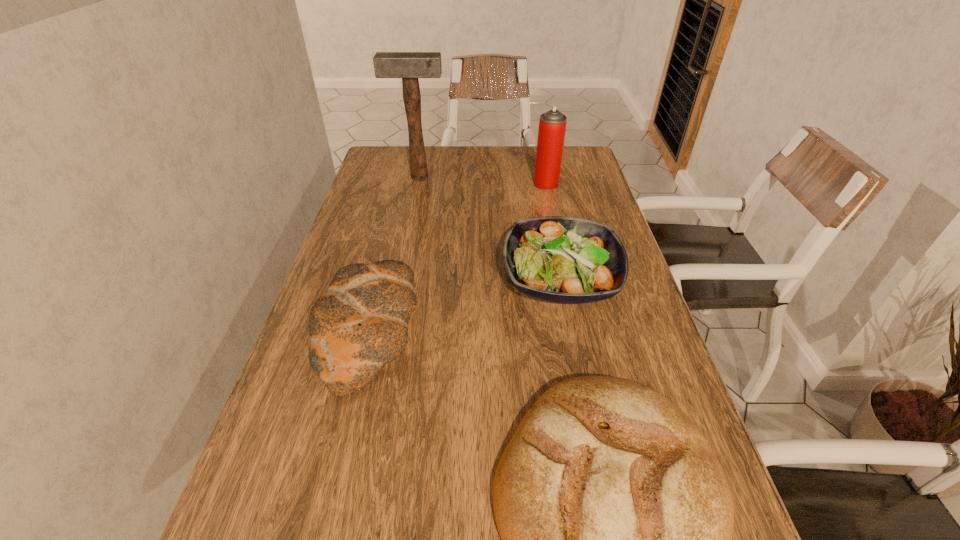
The height and width of the screenshot is (540, 960). I want to click on mallet, so click(409, 66).

At what (x,y) coordinates should I click in order to perform the action: click on aerosol can. Please return your answer as a coordinate pair (x, y). The width and height of the screenshot is (960, 540). Looking at the image, I should click on (552, 125).

This screenshot has height=540, width=960. In order to click on the left bread in this screenshot , I will do `click(359, 325)`.

Where is `salad plate`? This screenshot has height=540, width=960. salad plate is located at coordinates (557, 259).

Identify the location of vacant region located 0.150m on the front of the mallet. (414, 206).

Image resolution: width=960 pixels, height=540 pixels. What are the coordinates of `vacant space positioned on the left of the aerosol can` in the screenshot? It's located at pos(436,184).

Where is `vacant region located on the right of the left bread`? The width and height of the screenshot is (960, 540). vacant region located on the right of the left bread is located at coordinates (553, 330).

The height and width of the screenshot is (540, 960). Find the location of `vacant area situated on the back of the salad plate`. vacant area situated on the back of the salad plate is located at coordinates (539, 172).

At what (x,y) coordinates should I click in order to perform the action: click on mallet that is at the far edge. Please return your answer as a coordinate pair (x, y). Looking at the image, I should click on (409, 66).

You are a GUI agent. You are given a task and a screenshot of the screen. Output one action in this format:
    pyautogui.click(x=<x>, y=<y>)
    Task: Click on the aerosol can that is at the far edge
    The height and width of the screenshot is (540, 960).
    Given the screenshot: What is the action you would take?
    pyautogui.click(x=552, y=125)